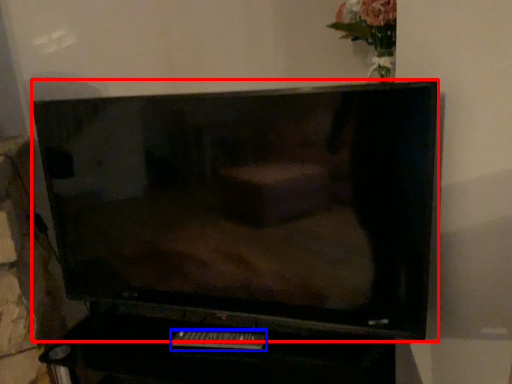
Question: Which point is closer to the camera, television (highlighted by a red box) or remote (highlighted by a blue box)?

Choices:
 (A) television
 (B) remote

Answer: (A)